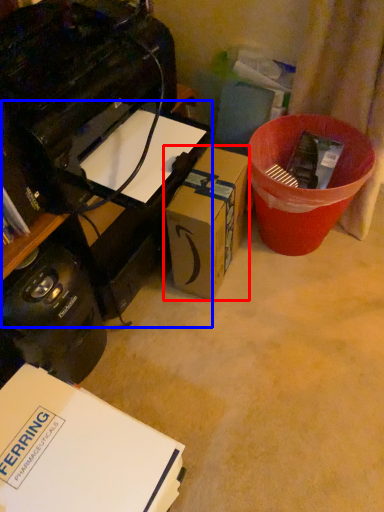
Question: Which point is further to the camera, box (highlighted by a red box) or computer desk (highlighted by a blue box)?

Choices:
 (A) box
 (B) computer desk

Answer: (B)